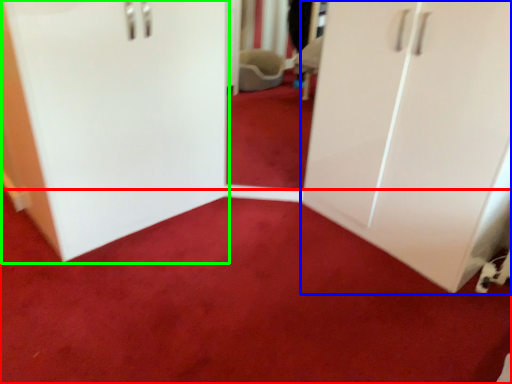
Question: Which is nearer to the plain (highlighted by a red box)? cupboard (highlighted by a blue box) or door (highlighted by a green box).

Choices:
 (A) cupboard
 (B) door

Answer: (A)